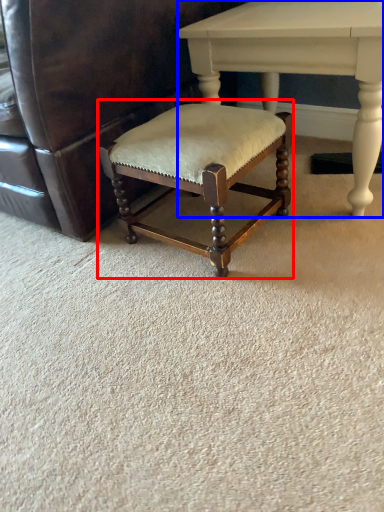
Question: Among these objects, which one is nearest to the camera, bar stool (highlighted by a red box) or table (highlighted by a blue box)?

Choices:
 (A) bar stool
 (B) table

Answer: (A)